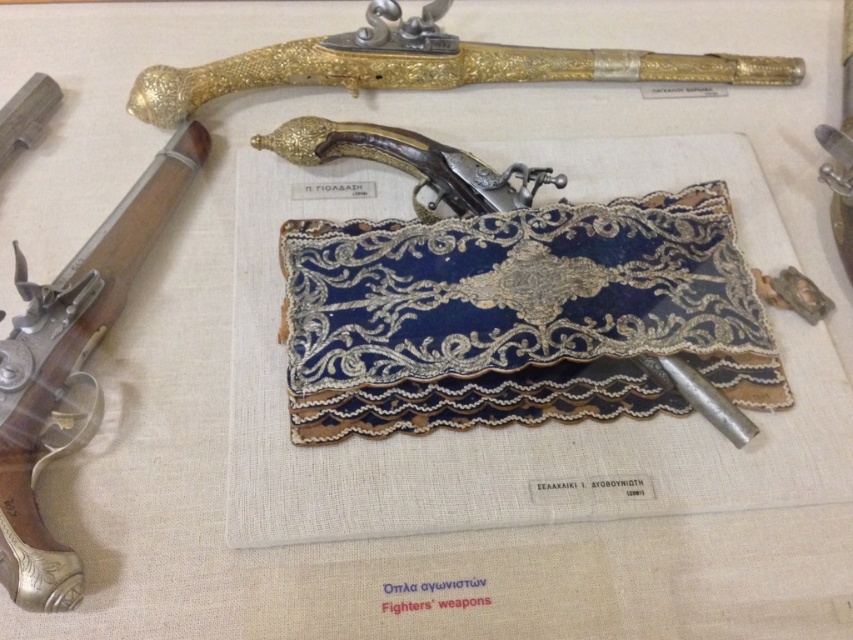
This screenshot has height=640, width=853. I want to click on blue embroidered cloth at center, so click(x=519, y=316).

Is blue embroidered cloth at center positioned in front of gold textured pistol at upper center?

Yes, blue embroidered cloth at center is in front of gold textured pistol at upper center.

The width and height of the screenshot is (853, 640). What do you see at coordinates (519, 316) in the screenshot?
I see `blue embroidered cloth at center` at bounding box center [519, 316].

The height and width of the screenshot is (640, 853). Find the location of `blue embroidered cloth at center`. blue embroidered cloth at center is located at coordinates (x=519, y=316).

Consider the image. Is blue embroidered cloth at center above polished silver handgun at left?

Actually, blue embroidered cloth at center is below polished silver handgun at left.

Does blue embroidered cloth at center appear on the right side of polished silver handgun at left?

Indeed, blue embroidered cloth at center is positioned on the right side of polished silver handgun at left.

Is point (437, 358) positioned behind point (28, 516)?

Yes, it is.

This screenshot has height=640, width=853. I want to click on blue embroidered cloth at center, so click(519, 316).

Who is positioned more to the right, polished silver handgun at left or gold textured pistol at upper center?

Positioned to the right is gold textured pistol at upper center.

Can you confirm if polished silver handgun at left is wider than gold textured pistol at upper center?

No.

Who is more forward, (45, 394) or (434, 8)?

Point (45, 394) is in front.

What are the coordinates of `polished silver handgun at left` in the screenshot? It's located at pos(70,365).